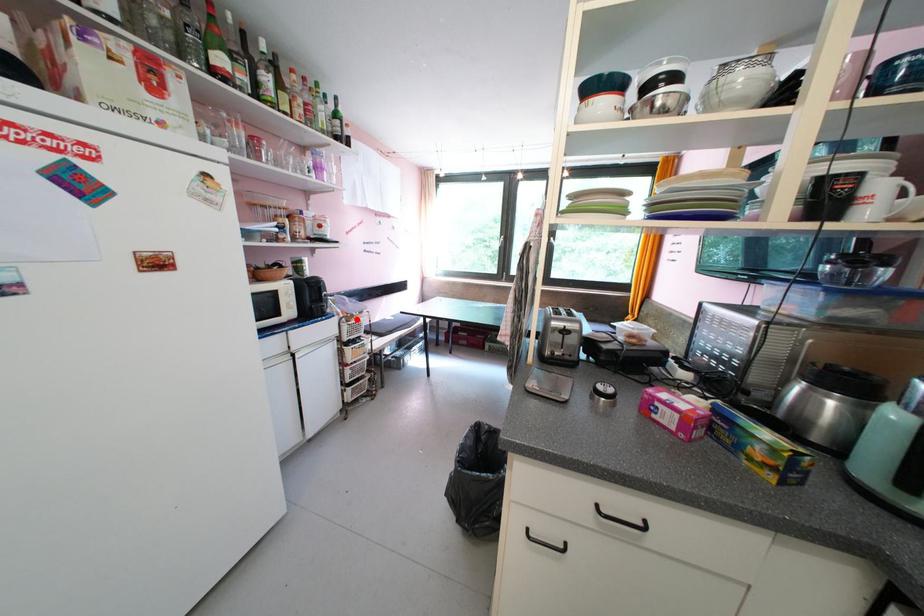
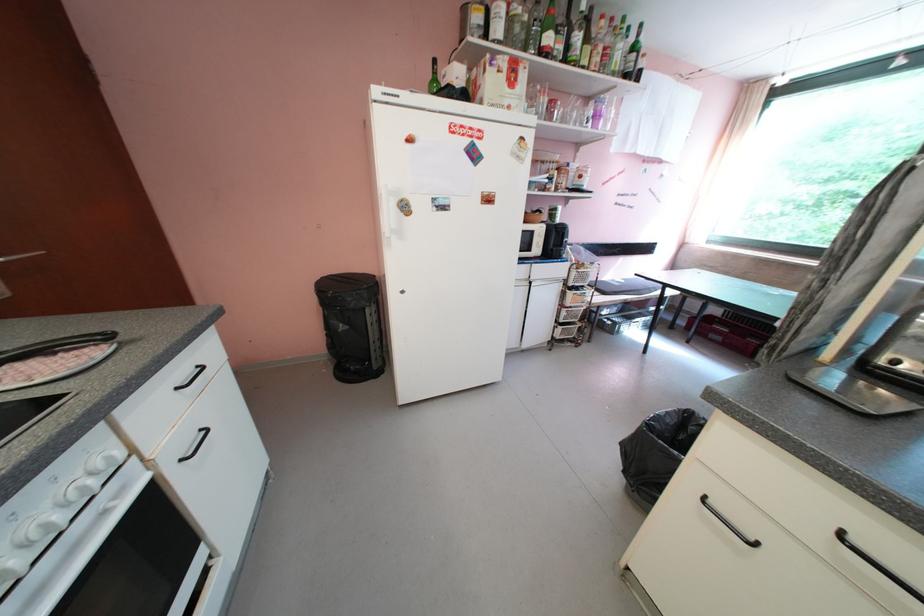
Locate, in the second image, the point that corresponds to the highlighted location in the first image.

(588, 268)